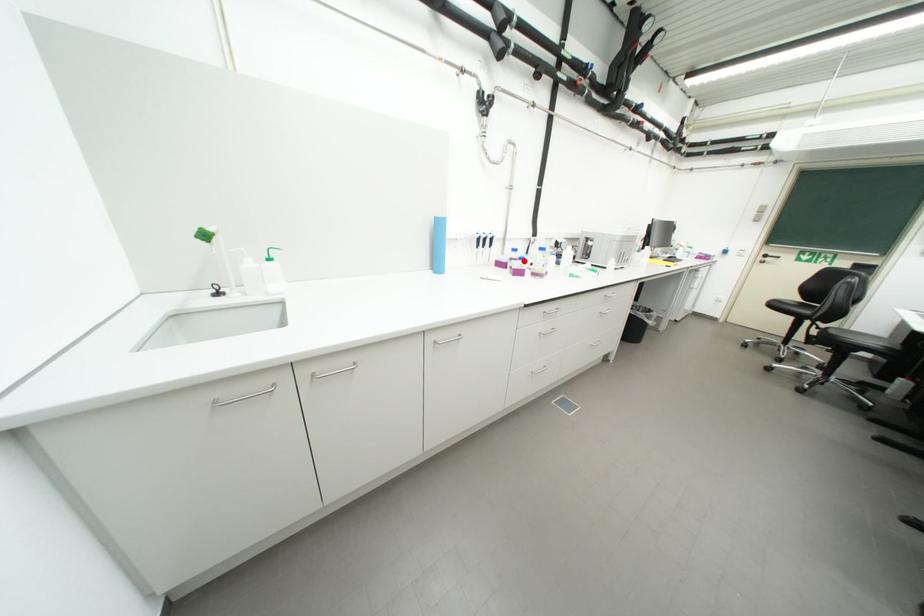
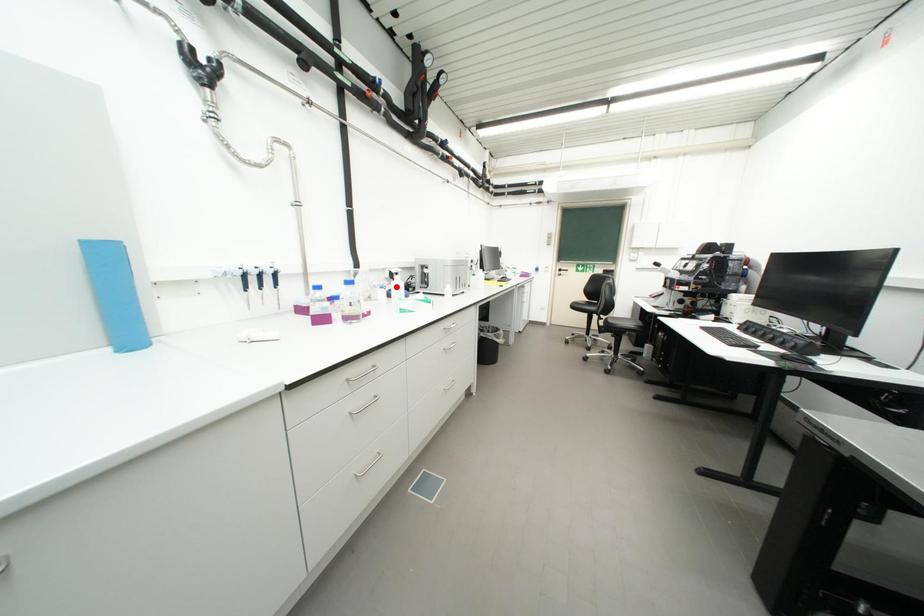
I am providing you with two images of the same scene from different viewpoints. A red point is marked on the first image and another point is marked on the second image. Does the point marked in image1 correspond to the same location as the one in image2?

No